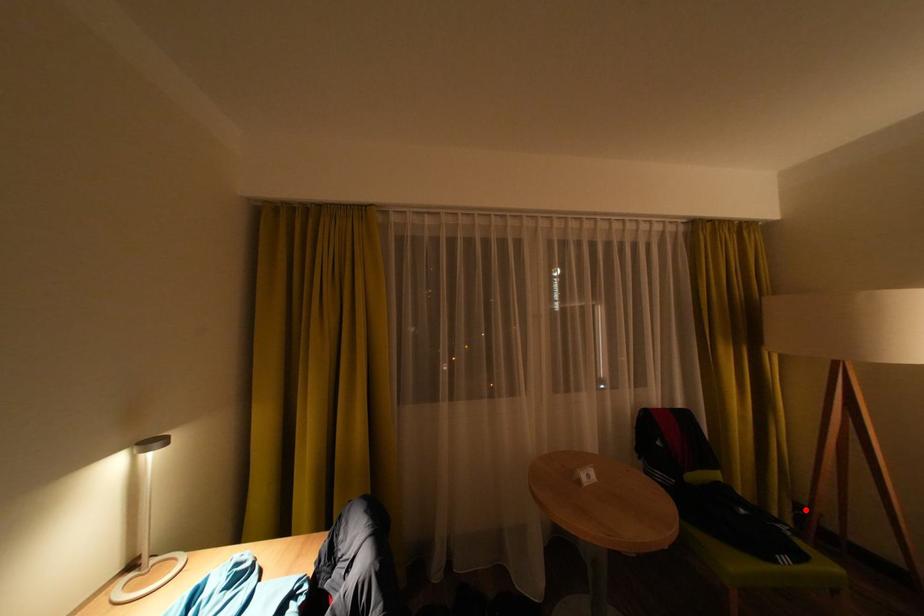
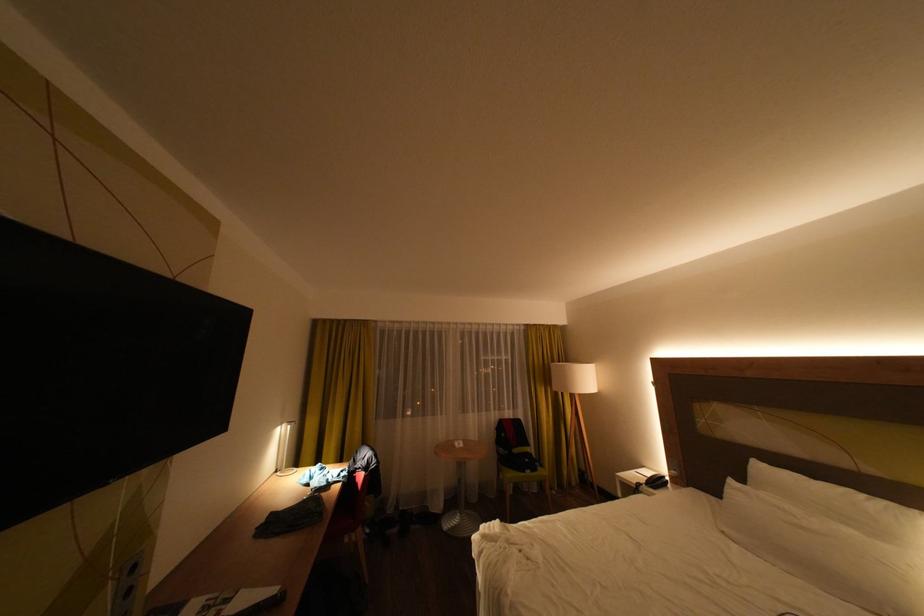
Question: I am providing you with two images of the same scene from different viewpoints. A red point is marked on the first image. Can you still see the location of the red point in image 2?

Choices:
 (A) Yes
 (B) No

Answer: (A)